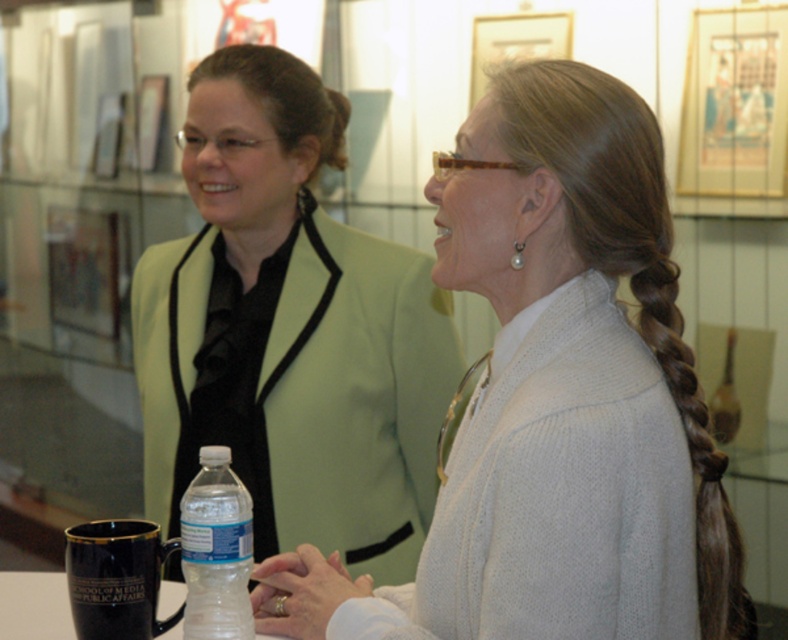
Between white knitted sweater at center and transparent plastic bottle at lower center, which one is positioned lower?

transparent plastic bottle at lower center is lower down.

Does point (485, 182) come behind point (17, 579)?

No, it is not.

The image size is (788, 640). I want to click on white knitted sweater at center, so click(x=575, y=385).

You are a GUI agent. You are given a task and a screenshot of the screen. Output one action in this format:
    pyautogui.click(x=<x>, y=<y>)
    Task: Click on the white knitted sweater at center
    
    Given the screenshot: What is the action you would take?
    pyautogui.click(x=575, y=385)

Image resolution: width=788 pixels, height=640 pixels. I want to click on clear plastic bottle at lower center, so click(216, 550).

Does point (181, 541) come in front of point (49, 608)?

Yes, it is in front of point (49, 608).

The width and height of the screenshot is (788, 640). Find the location of `clear plastic bottle at lower center`. clear plastic bottle at lower center is located at coordinates (216, 550).

Which is in front, point (549, 83) or point (207, 624)?

Point (549, 83)

Does white knitted sweater at center appear over clear plastic bottle at lower center?

Indeed, white knitted sweater at center is positioned over clear plastic bottle at lower center.

What do you see at coordinates (575, 385) in the screenshot?
I see `white knitted sweater at center` at bounding box center [575, 385].

In order to click on white knitted sweater at center in this screenshot , I will do `click(575, 385)`.